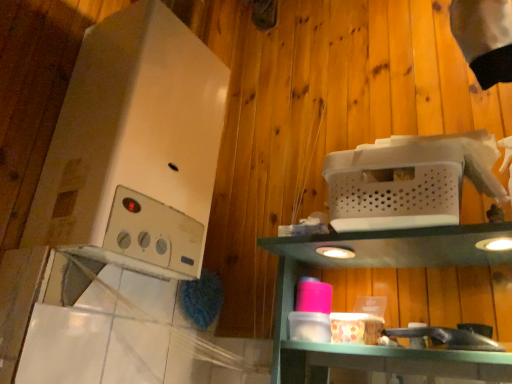
The height and width of the screenshot is (384, 512). In order to click on white glossy boiler at left in this screenshot , I will do `click(135, 144)`.

The height and width of the screenshot is (384, 512). What do you see at coordinates (135, 144) in the screenshot?
I see `white glossy boiler at left` at bounding box center [135, 144].

Locate an element on the screen. The width and height of the screenshot is (512, 384). white glossy boiler at left is located at coordinates (135, 144).